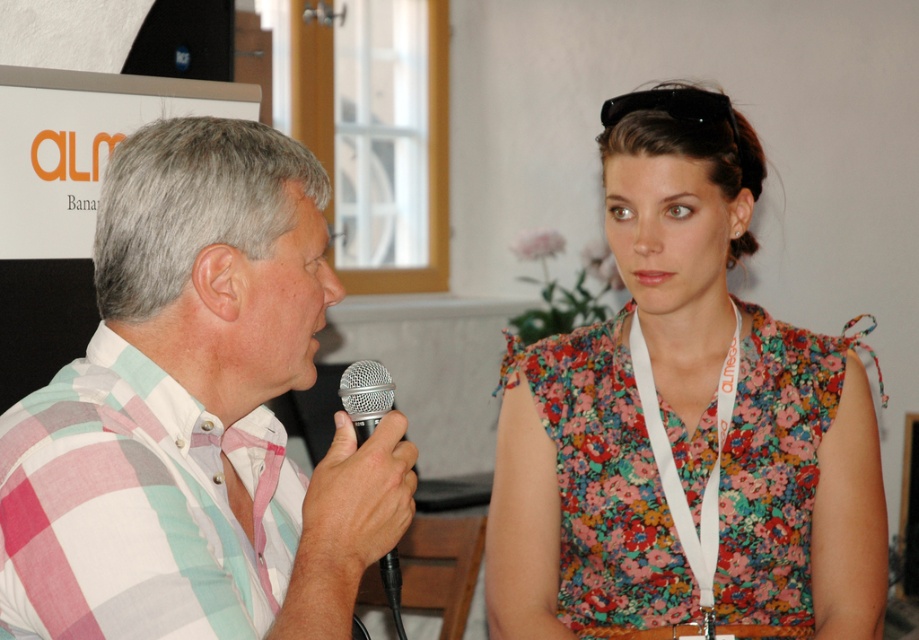
Question: Which object is farther from the camera taking this photo?

Choices:
 (A) floral fabric blouse at upper right
 (B) silver metallic microphone at center

Answer: (A)

Question: Which object appears farthest from the camera in this image?

Choices:
 (A) silver metallic microphone at center
 (B) floral fabric blouse at upper right
 (C) checkered fabric shirt at left

Answer: (B)

Question: Does floral fabric blouse at upper right have a smaller size compared to silver metallic microphone at center?

Choices:
 (A) no
 (B) yes

Answer: (A)

Question: Is floral fabric blouse at upper right wider than silver metallic microphone at center?

Choices:
 (A) yes
 (B) no

Answer: (A)

Question: Among these points, which one is nearest to the camera?

Choices:
 (A) (405, 464)
 (B) (392, 548)

Answer: (A)

Question: Can you confirm if checkered fabric shirt at left is positioned to the left of silver metallic microphone at center?

Choices:
 (A) no
 (B) yes

Answer: (B)